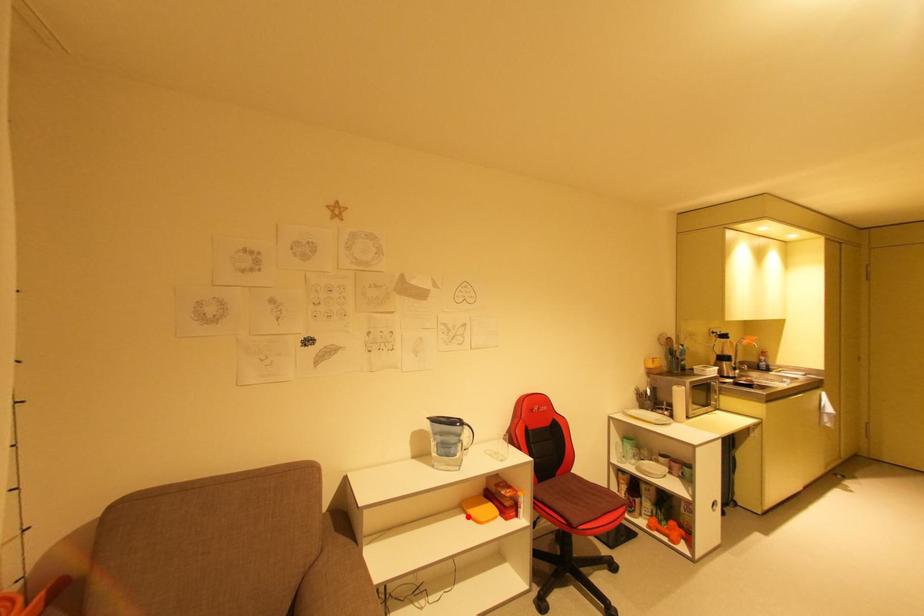
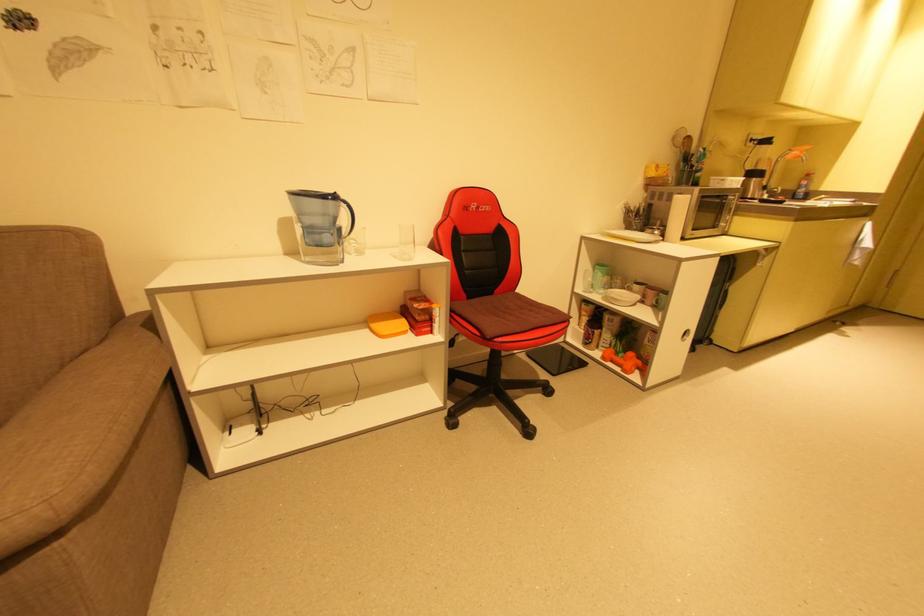
Where in the second image is the point corresponding to the highlighted location from the first image?

(371, 331)